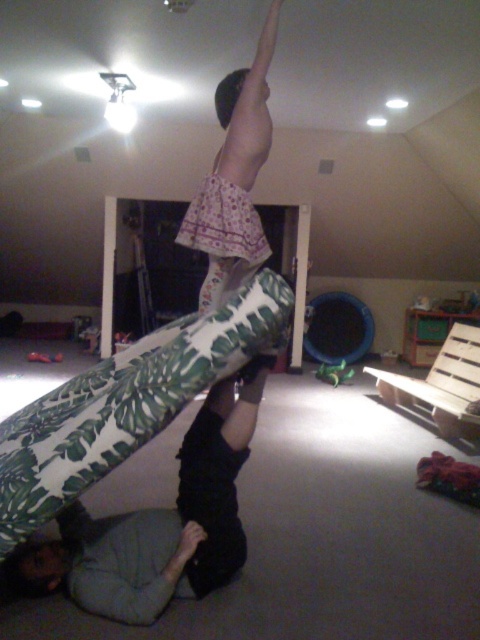
You are standing in the room and want to walk from the doorway to the ceiling light fixture. There are two points marked in the image, point (195,204) and point (424,403). Which point should you avoid stepping on to reach the light fixture safely?

You should avoid stepping on point (424,403) because point (195,204) is in front of it, meaning the path to the light fixture would be blocked by the point closer to you.

You are standing in the room and want to reach the point marked at coordinates point [250,257]. The doorway is 3 meters away from you. Can you walk directly to the point without going through the doorway?

The distance between you and point [250,257] is 2.89 meters, which is less than the 3 meters to the doorway. Therefore, you can reach the point without needing to go through the doorway.